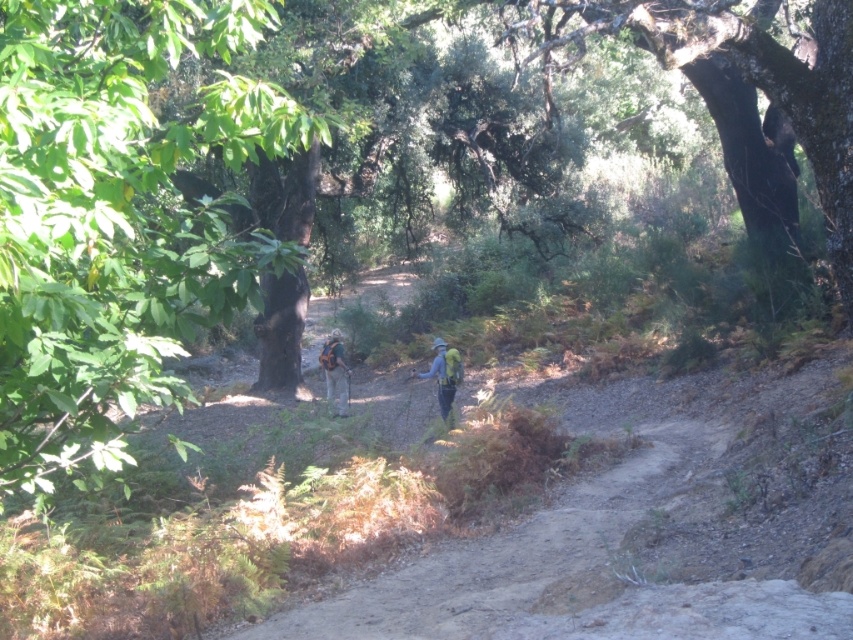
You are a hiker who wants to take a photo of the camouflage backpack at center without the green leafy tree at upper left blocking the view. Which direction should you move to ensure the tree is out of frame?

The green leafy tree at upper left is located above the camouflage backpack at center, so you should move downward or to the right to position yourself where the tree is no longer above the backpack, ensuring it doesn